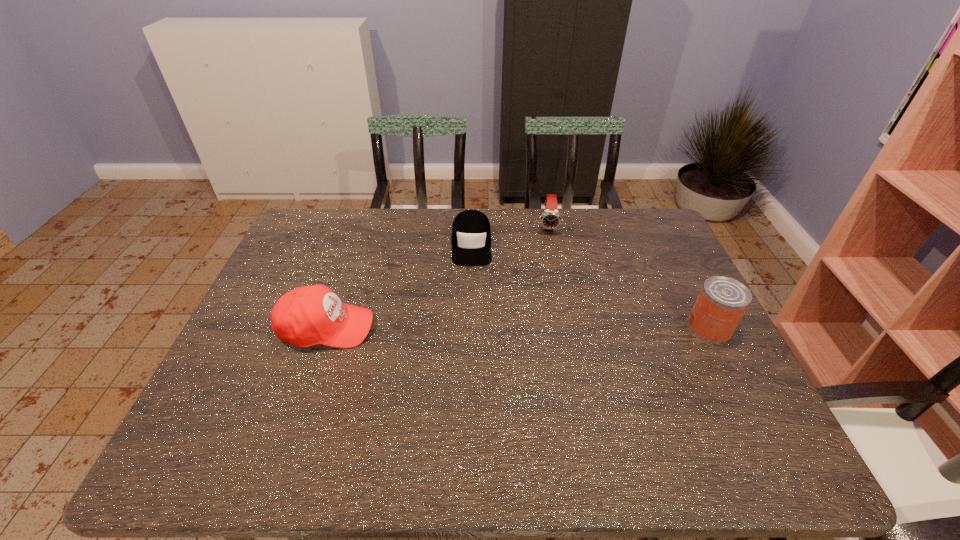
Where is `free space located on the front-facing side of the shortest object`? free space located on the front-facing side of the shortest object is located at coordinates (470, 314).

At what (x,y) coordinates should I click in order to perform the action: click on vacant area located on the front-facing side of the shortest object. Please return your answer as a coordinate pair (x, y). The image size is (960, 540). Looking at the image, I should click on (470, 328).

Identify the location of vacant space located 0.160m on the front-facing side of the shortest object. (470, 304).

I want to click on watch present at the far edge, so [x=550, y=219].

Find the location of `cap located in the far edge section of the desktop`. cap located in the far edge section of the desktop is located at coordinates (471, 235).

The width and height of the screenshot is (960, 540). What are the coordinates of `object situated at the left edge` in the screenshot? It's located at (305, 316).

Locate an element on the screen. object at the right edge is located at coordinates (722, 301).

Identify the location of free space at the far edge of the desktop. This screenshot has height=540, width=960. (500, 238).

Find the location of a particular element. The width and height of the screenshot is (960, 540). vacant space at the left edge of the desktop is located at coordinates (274, 338).

This screenshot has height=540, width=960. In the image, there is a desktop. In order to click on vacant area at the right edge in this screenshot , I will do `click(635, 260)`.